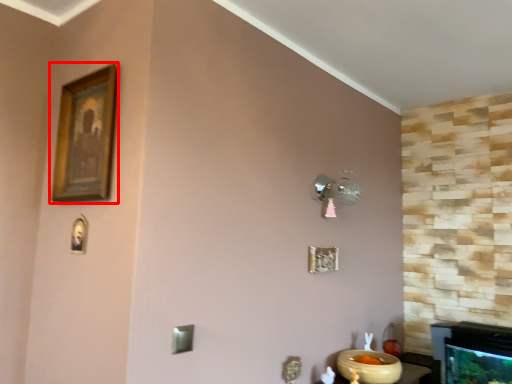
Question: From the image's perspective, considering the relative positions of picture frame (annotated by the red box) and glass bowl in the image provided, where is picture frame (annotated by the red box) located with respect to the staircase?

Choices:
 (A) above
 (B) below

Answer: (A)